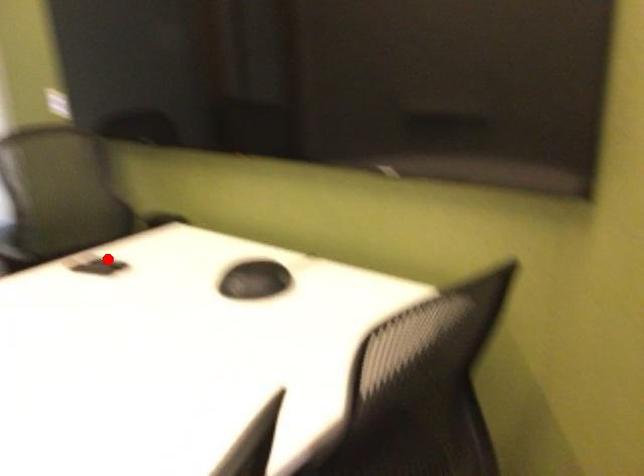
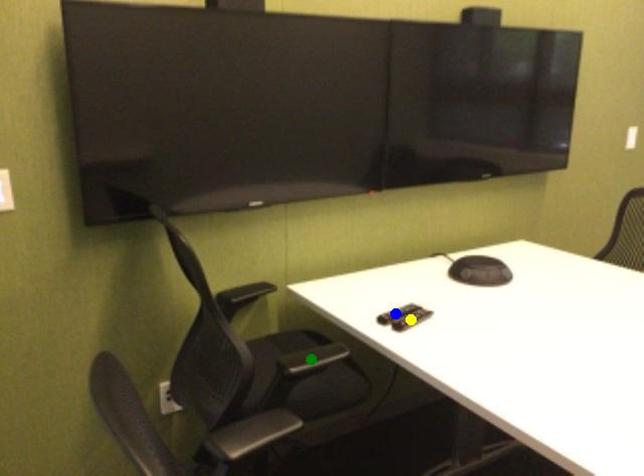
Question: I am providing you with two images of the same scene from different viewpoints. A red point is marked on the first image. You are given multiple points on the second image. Which point in image 2 is actually the same real-world point as the red point in image 1?

Choices:
 (A) yellow point
 (B) blue point
 (C) green point

Answer: (B)